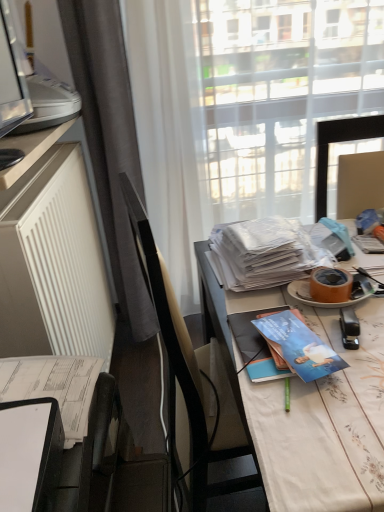
Where is `free space between orange matte plate at right and blue glossy book at center, the 1th magazine when ordered from bottom to top`? This screenshot has width=384, height=512. free space between orange matte plate at right and blue glossy book at center, the 1th magazine when ordered from bottom to top is located at coordinates (308, 315).